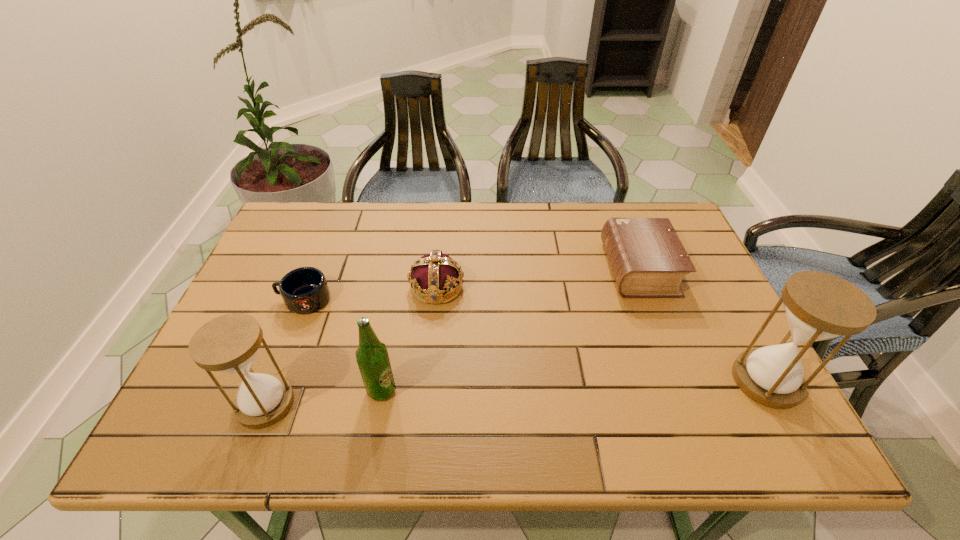
Please determine a free point for an extra hourglass to ensure balance. Please provide its 2D coordinates. Your answer should be formatted as a tuple, i.e. [(x, y)], where the tuple contains the x and y coordinates of a point satisfying the conditions above.

[(521, 392)]